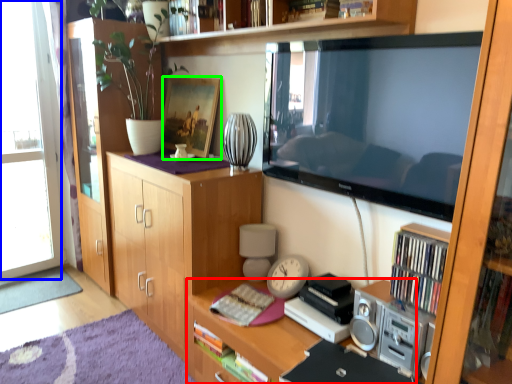
Question: Which is farther away from desk (highlighted by a red box)? window (highlighted by a blue box) or picture frame (highlighted by a green box)?

Choices:
 (A) window
 (B) picture frame

Answer: (A)